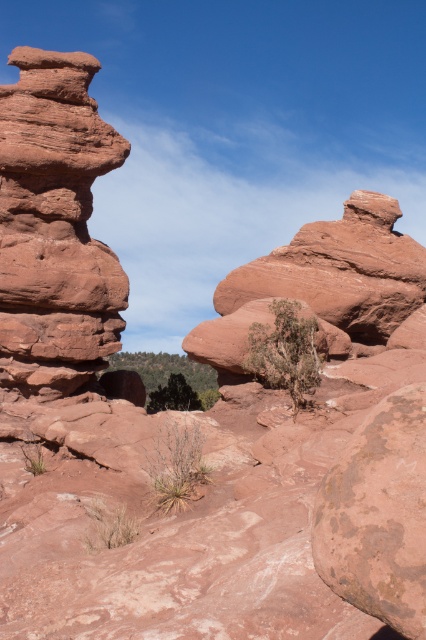
You are an archaeologist examining the rock formations in the image. You need to determine which object at the center has a greater width between the rustic sandstone rock at center and the rusty stone boulder at center. Based on the scene, can you identify which one is wider?

The rustic sandstone rock at center is wider than the rusty stone boulder at center according to the description provided.

You are standing in the middle of the red rock formations. There is a point marked at coordinates (321,284). What does this point indicate?

The point at (321,284) marks the rustic sandstone rock at center.